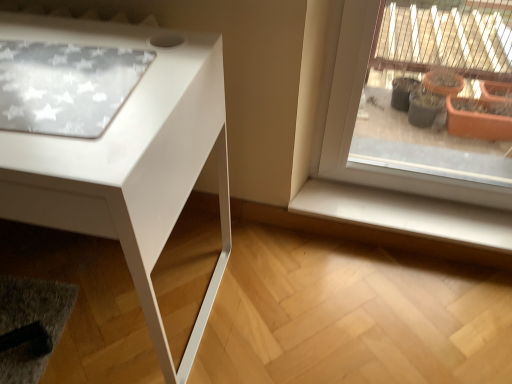
Identify the location of free area below white glossy table at left (from a real-world perspective). The width and height of the screenshot is (512, 384). (82, 297).